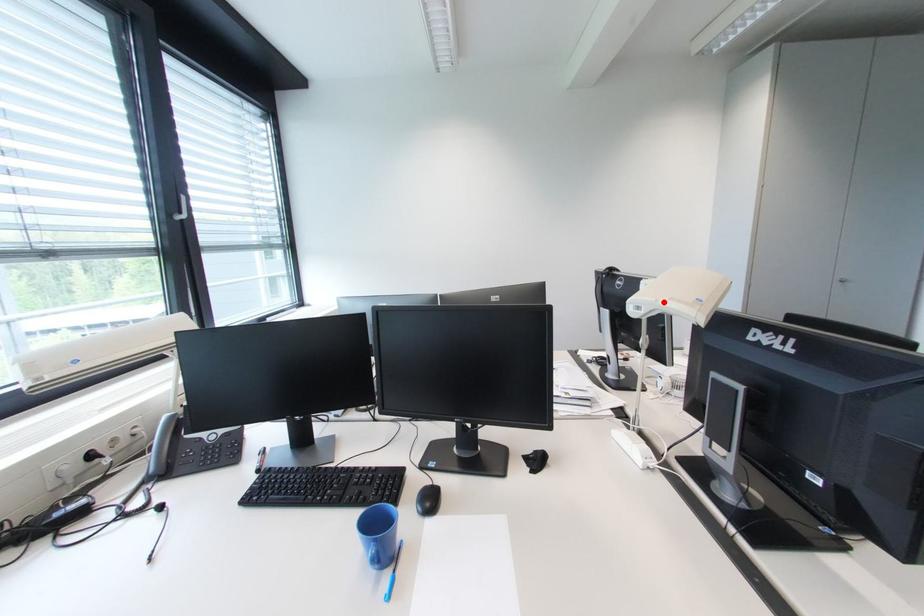
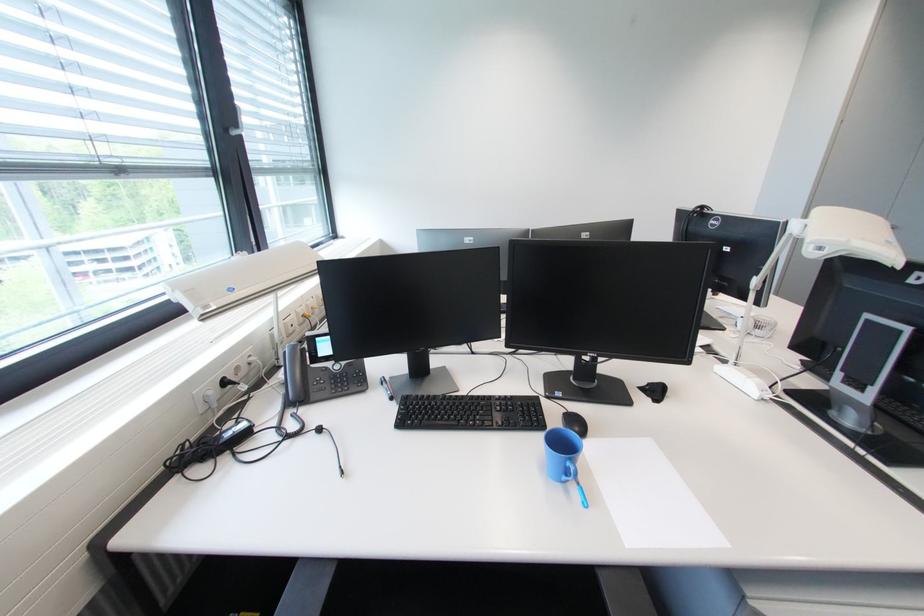
Question: A red point is marked in image1. In image2, is the corresponding 3D point closer to the camera or farther? Reply with the corresponding letter.

Choices:
 (A) The corresponding 3D point is closer.
 (B) The corresponding 3D point is farther.

Answer: (A)